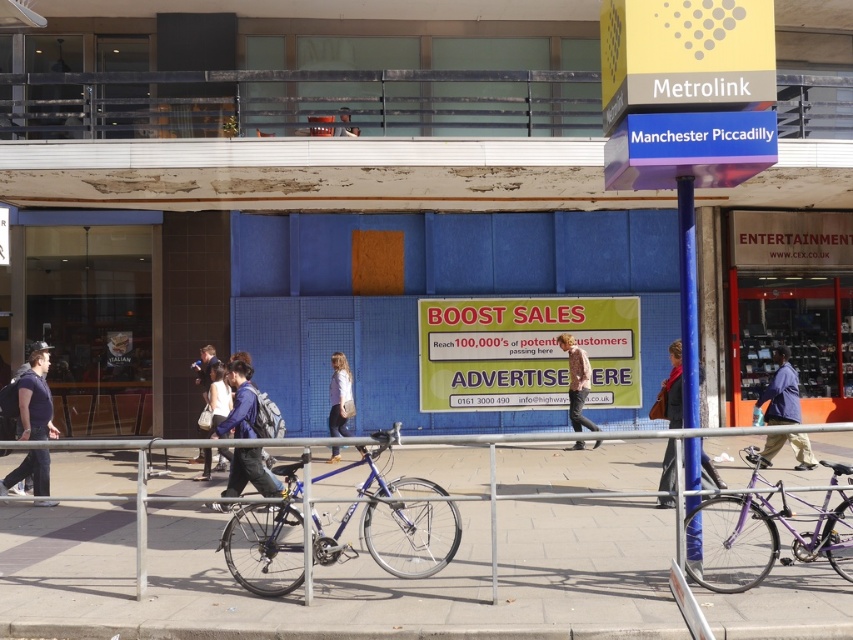
Question: Which point is closer to the camera?

Choices:
 (A) (22, 401)
 (B) (433, 564)
 (C) (587, 385)
 (D) (645, 612)

Answer: (D)

Question: Is light brown leather jacket at center in front of matte blue jacket at center?

Choices:
 (A) yes
 (B) no

Answer: (B)

Question: Which object is farther from the camera taking this photo?

Choices:
 (A) shiny blue bicycle at center
 (B) concrete pavement at center
 (C) matte black jacket at center
 (D) matte black backpack at center

Answer: (D)

Question: Does matte black jacket at center come in front of matte blue jacket at center?

Choices:
 (A) yes
 (B) no

Answer: (B)

Question: Where is concrete pavement at center located in relation to matte blue jacket at center in the image?

Choices:
 (A) left
 (B) right

Answer: (B)

Question: Considering the real-world distances, which object is closest to the purple metallic bicycle at center?

Choices:
 (A) blue denim jacket at center
 (B) denim jacket at center
 (C) matte black backpack at center
 (D) light blue jeans at center

Answer: (A)